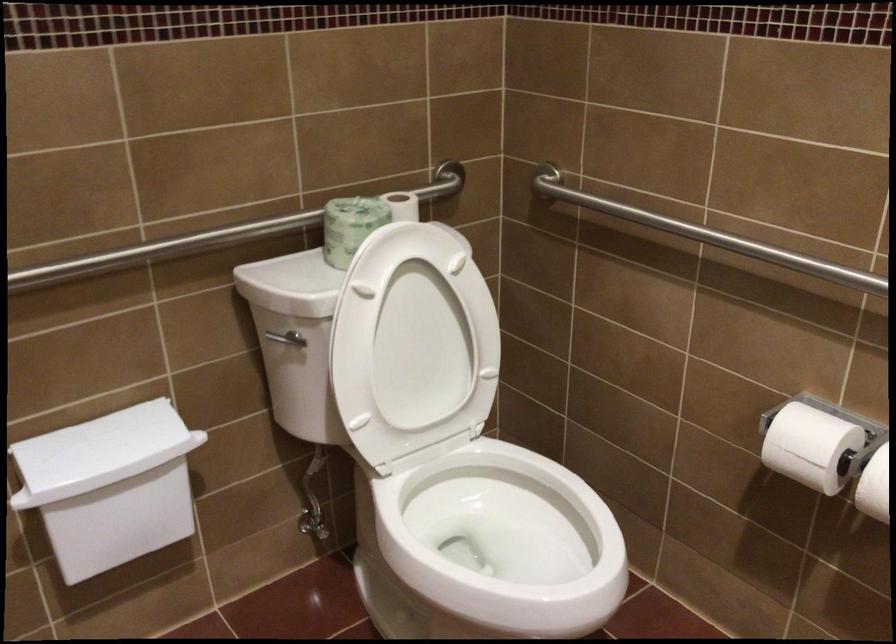
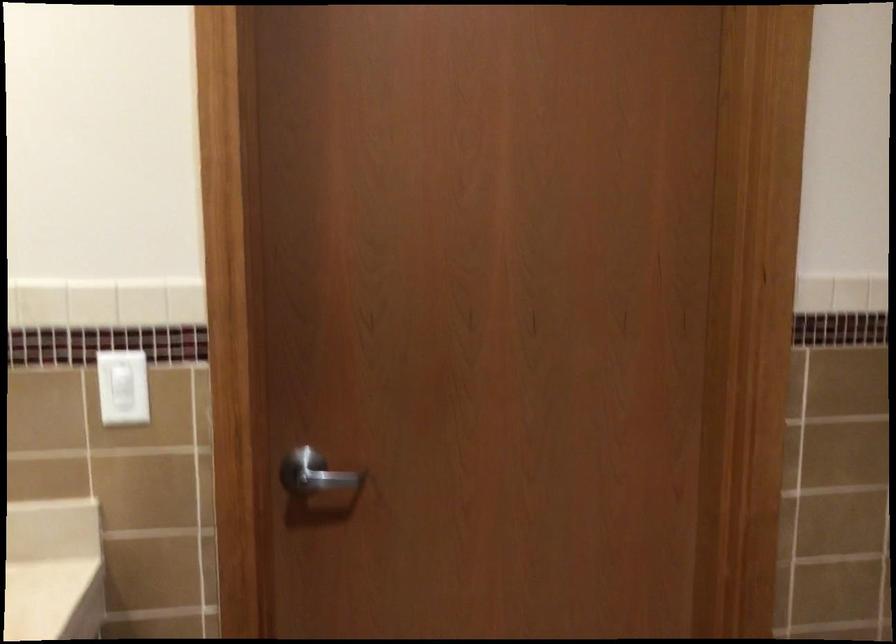
How did the camera likely rotate?

The camera rotated toward left-down.